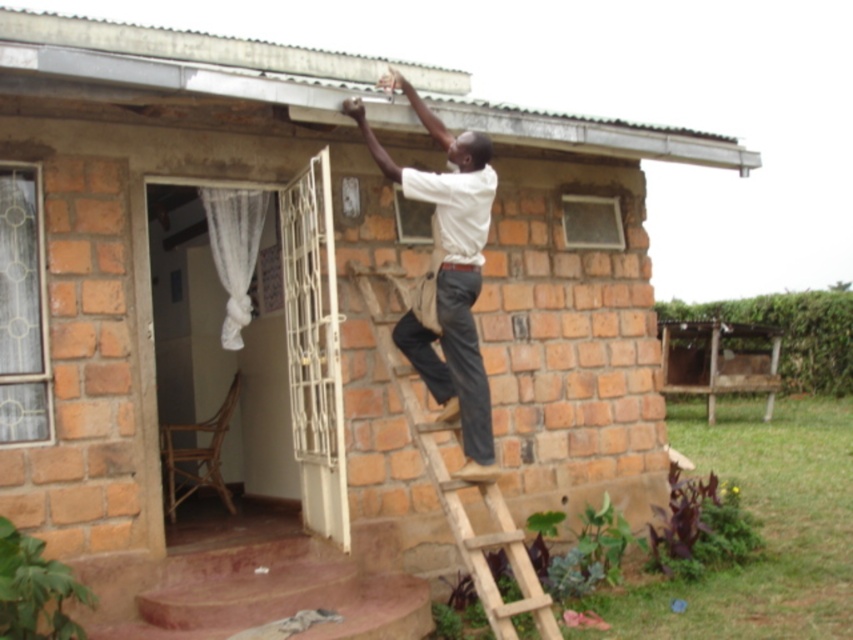
Question: Among these points, which one is farthest from the camera?

Choices:
 (A) (202, 189)
 (B) (428, 371)
 (C) (459, 540)

Answer: (A)

Question: Is wooden at right to the left of white sheer curtain at left from the viewer's perspective?

Choices:
 (A) no
 (B) yes

Answer: (A)

Question: Can you confirm if wooden at right is positioned to the left of white sheer curtain at left?

Choices:
 (A) no
 (B) yes

Answer: (A)

Question: Which point is closer to the camera?

Choices:
 (A) (456, 221)
 (B) (215, 252)
 (C) (389, 323)

Answer: (A)

Question: Does white shirt at upper center appear under wooden at right?

Choices:
 (A) no
 (B) yes

Answer: (A)

Question: Among these objects, which one is farthest from the camera?

Choices:
 (A) wooden at right
 (B) white sheer curtain at left
 (C) white shirt at upper center

Answer: (B)